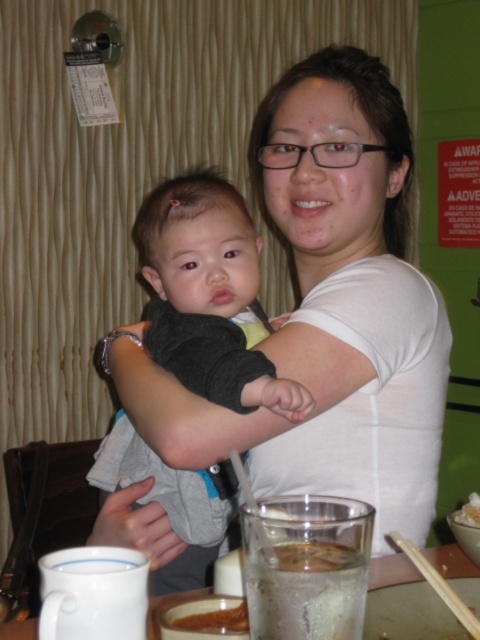
Question: Which object is farther from the camera taking this photo?

Choices:
 (A) gray soft baby at center
 (B) white creamy rice at center
 (C) brown creamy soup at lower center

Answer: (B)

Question: Observing the image, what is the correct spatial positioning of white matte shirt at center in reference to gray soft baby at center?

Choices:
 (A) below
 (B) above

Answer: (B)

Question: Estimate the real-world distances between objects in this image. Which object is farther from the white matte shirt at center?

Choices:
 (A) white creamy rice at center
 (B) clear glass water at lower center

Answer: (B)

Question: Does white matte shirt at center appear on the left side of clear glass water at lower center?

Choices:
 (A) yes
 (B) no

Answer: (A)

Question: Which object is the farthest from the brown creamy soup at lower center?

Choices:
 (A) clear glass water at lower center
 (B) gray soft baby at center

Answer: (B)

Question: Is gray soft baby at center positioned behind clear glass water at lower center?

Choices:
 (A) yes
 (B) no

Answer: (B)